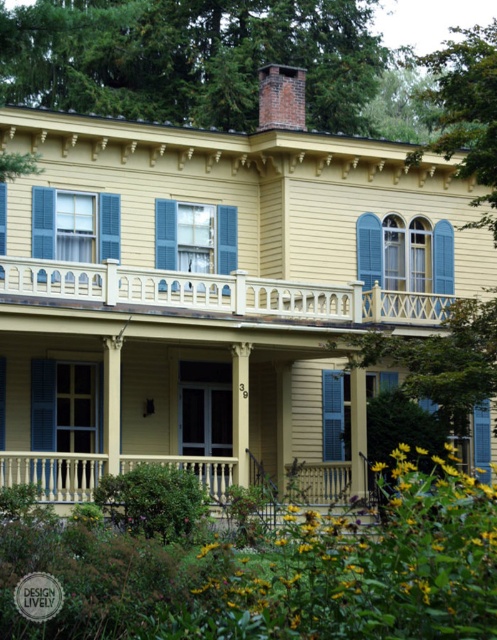
You are standing on the porch of the house and want to see the blue painted wood shutter at center. Is the yellow wood railing at upper center blocking your view of it?

The yellow wood railing at upper center is in front of the blue painted wood shutter at center, so it is blocking your view of the blue painted wood shutter at center.

You are a delivery person with a package that requires a 2 meter clearance to pass through the space between the yellow wood railing at upper center and the blue painted wood shutter at center. Can you safely navigate through this space with your delivery vehicle?

The yellow wood railing at upper center is 7.61 meters from the blue painted wood shutter at center, so yes, the delivery vehicle can safely navigate through the space since the distance between them is greater than the required 2 meter clearance.

You are standing in front of the Victorian house and see two points marked on the image. Which point is closer to you, point (243, 278) or point (326, 452)?

Point (243, 278) is in front of point (326, 452), so it is closer to you.